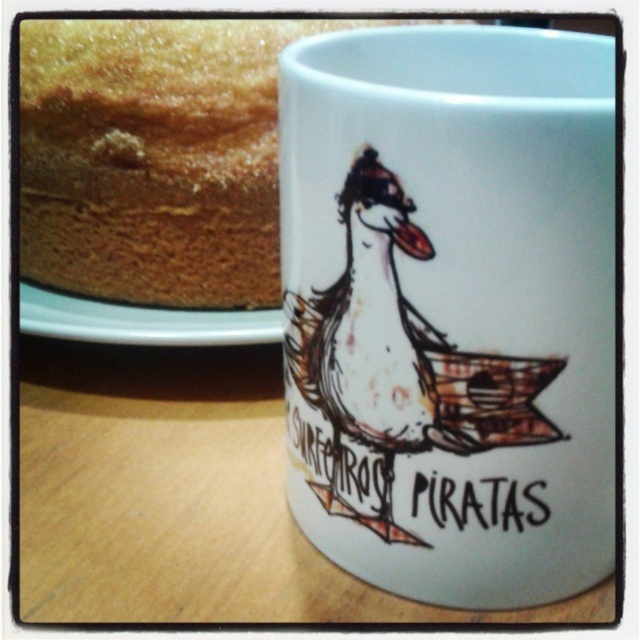
Between golden brown sponge cake at upper left and white glossy plate at upper left, which one has more height?

golden brown sponge cake at upper left is taller.

Is golden brown sponge cake at upper left smaller than white glossy plate at upper left?

Actually, golden brown sponge cake at upper left might be larger than white glossy plate at upper left.

Does point (262, 208) come in front of point (150, 316)?

Yes.

Find the location of a particular element. golden brown sponge cake at upper left is located at coordinates (154, 157).

Does white matte mug at upper center appear on the left side of white glossy plate at upper left?

No, white matte mug at upper center is not to the left of white glossy plate at upper left.

Does white matte mug at upper center come behind white glossy plate at upper left?

No, it is not.

Find the location of `white matte mug at upper center`. white matte mug at upper center is located at coordinates (451, 308).

Between white matte mug at upper center and wooden table at lower center, which one is positioned lower?

wooden table at lower center is lower down.

Between white matte mug at upper center and wooden table at lower center, which one appears on the left side from the viewer's perspective?

From the viewer's perspective, wooden table at lower center appears more on the left side.

The width and height of the screenshot is (640, 640). Identify the location of white matte mug at upper center. (451, 308).